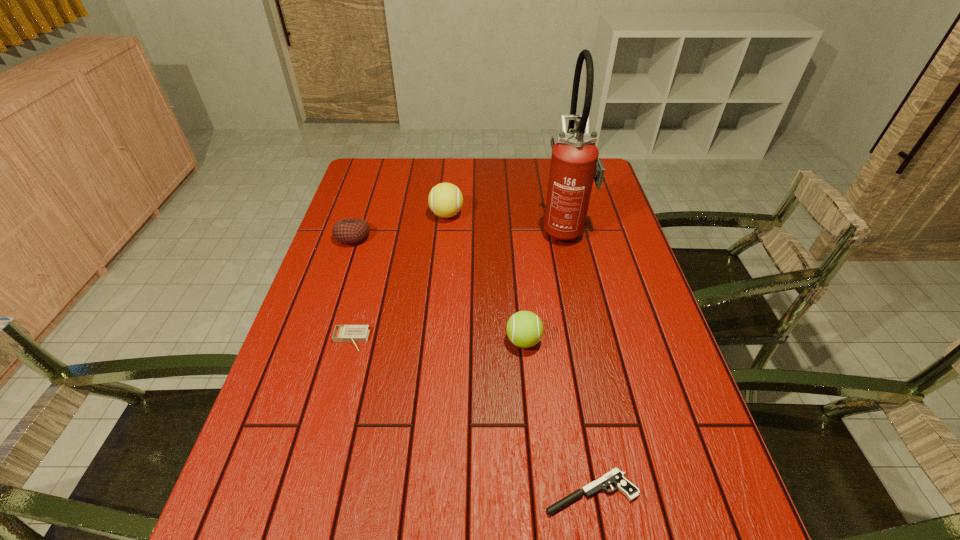
You are a GUI agent. You are given a task and a screenshot of the screen. Output one action in this format:
    pyautogui.click(x=<x>, y=<y>)
    Task: Click on the fire extinguisher
    
    Given the screenshot: What is the action you would take?
    pyautogui.click(x=575, y=164)

You are a GUI agent. You are given a task and a screenshot of the screen. Output one action in this format:
    pyautogui.click(x=<x>, y=<y>)
    Task: Click on the second tallest object
    
    Given the screenshot: What is the action you would take?
    pyautogui.click(x=445, y=199)

Where is `the taller tennis ball`? The width and height of the screenshot is (960, 540). the taller tennis ball is located at coordinates (445, 199).

Locate an element on the screen. Image resolution: width=960 pixels, height=540 pixels. the nearer tennis ball is located at coordinates (524, 329).

Locate an element on the screen. Image resolution: width=960 pixels, height=540 pixels. the right tennis ball is located at coordinates (524, 329).

Locate an element on the screen. the fourth tallest object is located at coordinates pyautogui.click(x=350, y=231).

At what (x,y) coordinates should I click in order to perform the action: click on matchbox. Please return your answer as a coordinate pair (x, y). This screenshot has height=540, width=960. Looking at the image, I should click on (342, 333).

What are the coordinates of `pistol` in the screenshot? It's located at (615, 476).

Where is `the shortest object`? The width and height of the screenshot is (960, 540). the shortest object is located at coordinates (615, 476).

At what (x,y) coordinates should I click in order to perform the action: click on vacant space situated 0.390m at the nozzle of the fire extinguisher. Please return your answer as a coordinate pair (x, y). Looking at the image, I should click on (420, 228).